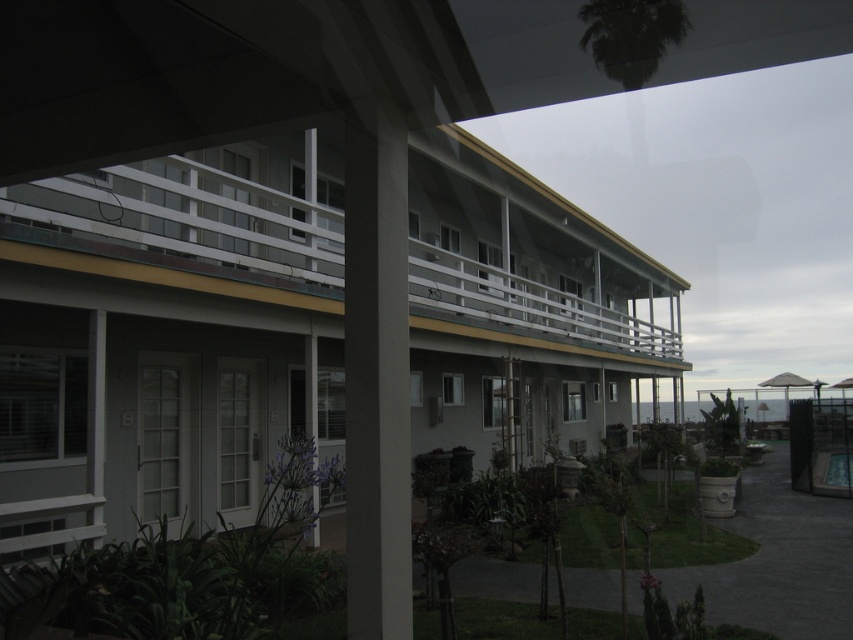
Question: Is white matte building at center above white painted wood balcony at upper center?

Choices:
 (A) yes
 (B) no

Answer: (B)

Question: Considering the real-world distances, which object is farthest from the gray concrete pillar at center?

Choices:
 (A) white painted wood balcony at upper center
 (B) white matte building at center

Answer: (B)

Question: Which of the following is the closest to the observer?

Choices:
 (A) (380, 625)
 (B) (251, 476)

Answer: (A)

Question: Which object appears closest to the camera in this image?

Choices:
 (A) white matte building at center
 (B) white painted wood balcony at upper center

Answer: (A)

Question: Does white matte building at center appear over gray concrete pillar at center?

Choices:
 (A) yes
 (B) no

Answer: (B)

Question: Does white matte building at center appear under white painted wood balcony at upper center?

Choices:
 (A) yes
 (B) no

Answer: (A)